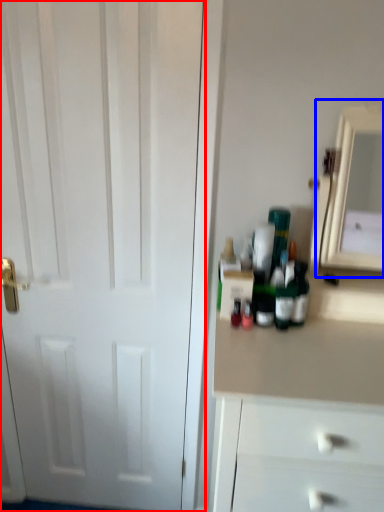
Question: Among these objects, which one is nearest to the camera, door (highlighted by a red box) or medicine cabinet (highlighted by a blue box)?

Choices:
 (A) door
 (B) medicine cabinet

Answer: (B)